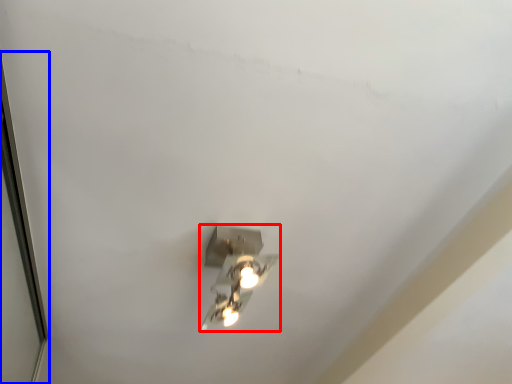
Question: Among these objects, which one is nearest to the camera, lamp (highlighted by a red box) or glass door (highlighted by a blue box)?

Choices:
 (A) lamp
 (B) glass door

Answer: (B)